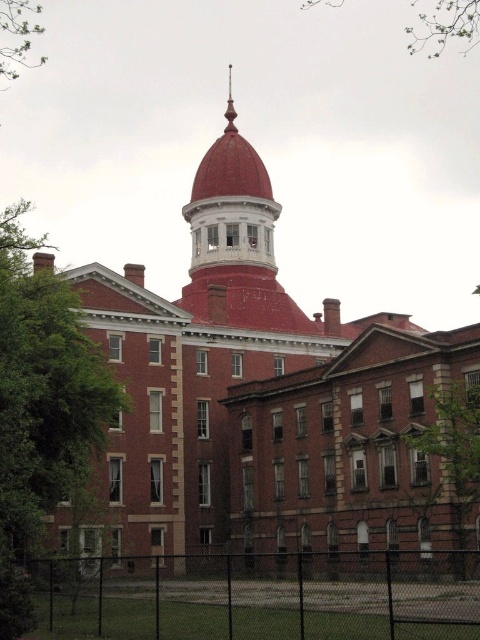
Is black chain-link fence at lower center bigger than green leafy tree at upper left?

Incorrect, black chain-link fence at lower center is not larger than green leafy tree at upper left.

Does black chain-link fence at lower center have a lesser width compared to green leafy tree at upper left?

No.

At what (x,y) coordinates should I click in order to perform the action: click on black chain-link fence at lower center. Please return your answer as a coordinate pair (x, y). This screenshot has width=480, height=640. Looking at the image, I should click on (263, 595).

Is black chain-link fence at lower center positioned behind green leafy tree at lower right?

No, it is in front of green leafy tree at lower right.

Which is below, black chain-link fence at lower center or green leafy tree at lower right?

black chain-link fence at lower center

Locate an element on the screen. The width and height of the screenshot is (480, 640). black chain-link fence at lower center is located at coordinates (263, 595).

Can you confirm if black chain-link fence at lower center is positioned above green leafy branches at upper center?

Incorrect, black chain-link fence at lower center is not positioned above green leafy branches at upper center.

This screenshot has height=640, width=480. What do you see at coordinates (263, 595) in the screenshot? I see `black chain-link fence at lower center` at bounding box center [263, 595].

This screenshot has height=640, width=480. I want to click on black chain-link fence at lower center, so click(263, 595).